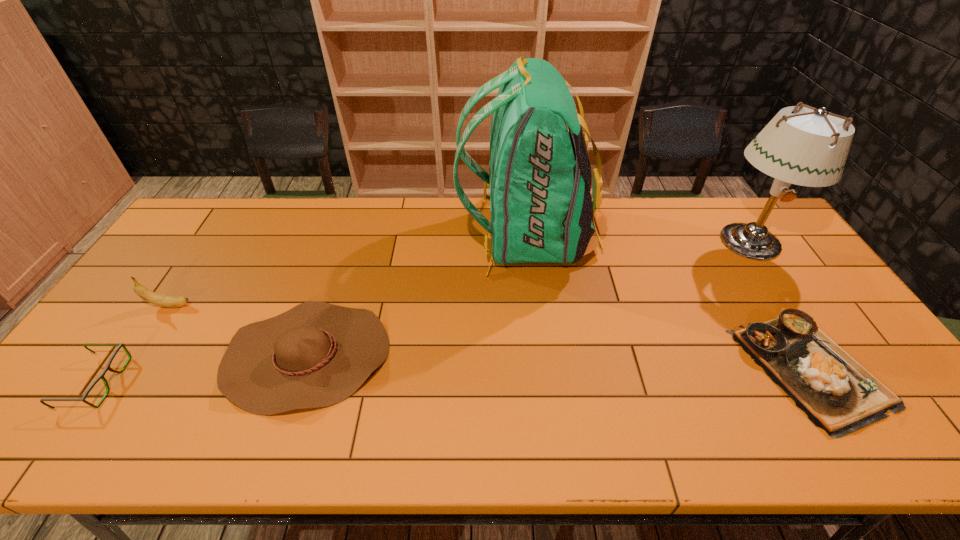
Identify the location of free point between the third object from left to right and the tallest object. (417, 296).

Locate an element on the screen. Image resolution: width=960 pixels, height=540 pixels. vacant area between the third tallest object and the fifth shortest object is located at coordinates (460, 274).

You are a GUI agent. You are given a task and a screenshot of the screen. Output one action in this format:
    pyautogui.click(x=<x>, y=<y>)
    Task: Click on the empty space that is in between the fourth object from right to left and the lampshade
    
    Given the screenshot: What is the action you would take?
    pyautogui.click(x=527, y=299)

Locate an element on the screen. blank region between the cowboy hat and the lampshade is located at coordinates (527, 299).

The width and height of the screenshot is (960, 540). I want to click on vacant space in between the lampshade and the cowboy hat, so click(527, 299).

Find the location of a particular element. vacant space that is in between the third tallest object and the spectacles is located at coordinates (133, 344).

The width and height of the screenshot is (960, 540). Identify the location of free spot between the tallest object and the cowboy hat. pos(417,296).

Find the location of a particular element. The height and width of the screenshot is (540, 960). free space between the backpack and the third object from left to right is located at coordinates (417, 296).

Select which object appears as the closest to the third object from left to right. Please provide its 2D coordinates. Your answer should be formatted as a tuple, i.e. [(x, y)], where the tuple contains the x and y coordinates of a point satisfying the conditions above.

[(157, 299)]

Image resolution: width=960 pixels, height=540 pixels. I want to click on object that is the fourth closest to the third shortest object, so click(x=837, y=394).